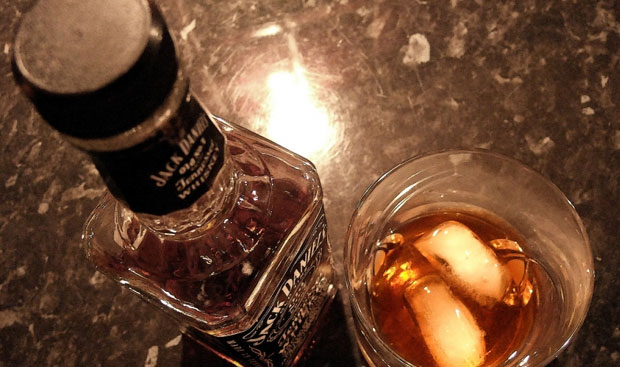
At what (x,y) coordinates should I click in order to perform the action: click on glare from overhead light. Please return your answer as a coordinate pair (x, y). Looking at the image, I should click on click(321, 109).